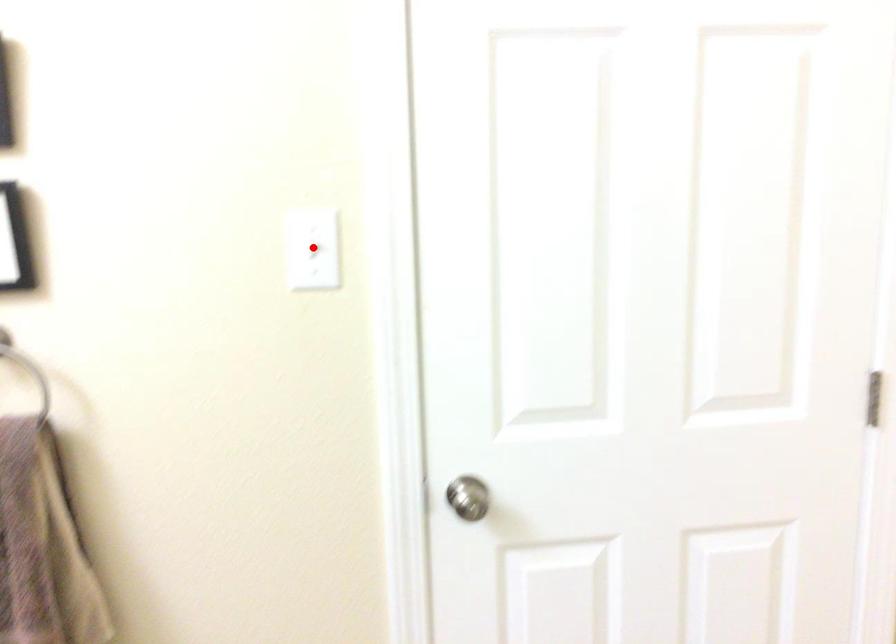
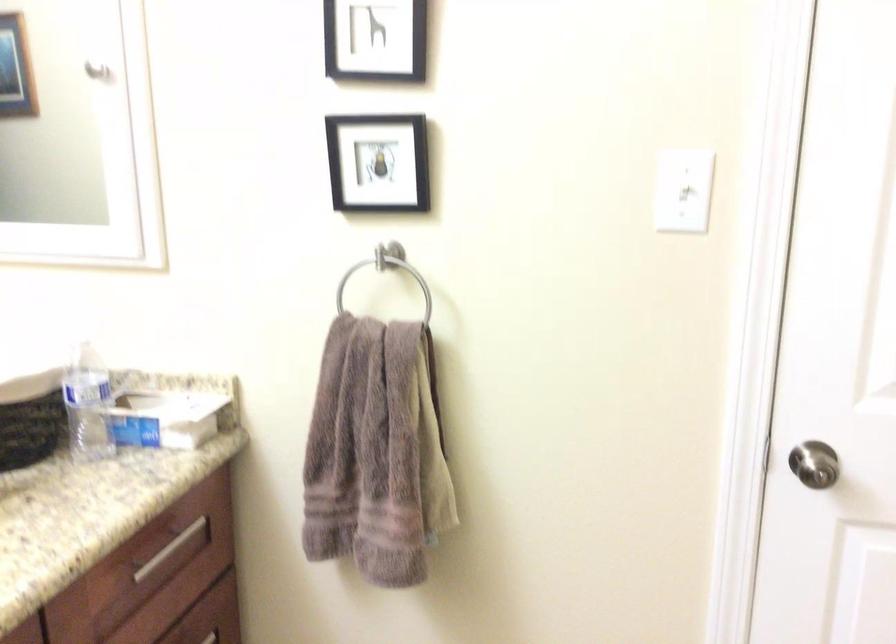
The point at the highlighted location is marked in the first image. Where is the corresponding point in the second image?

(683, 190)